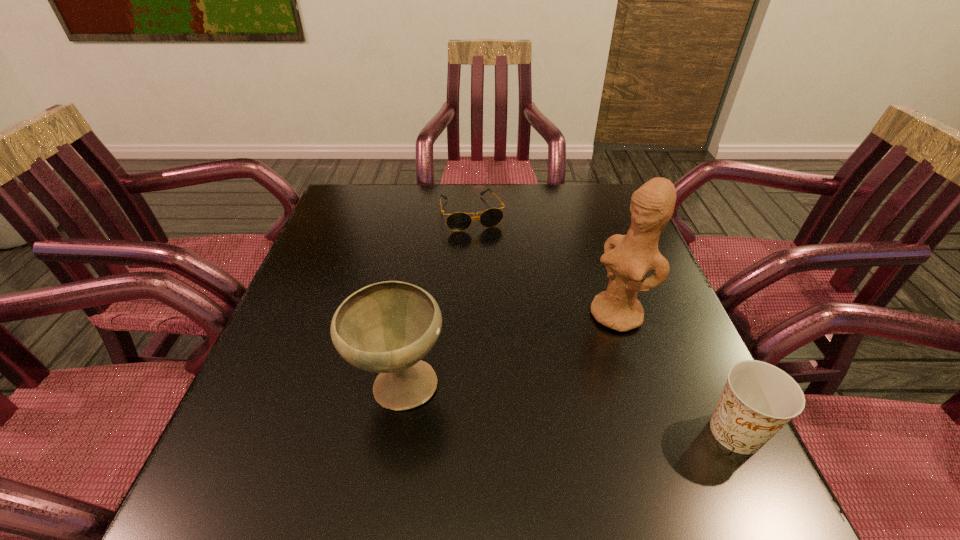
Identify the location of the second tallest object. The image size is (960, 540). (388, 327).

I want to click on Dixie cup, so click(x=759, y=399).

Where is `the second shortest object`? The height and width of the screenshot is (540, 960). the second shortest object is located at coordinates (759, 399).

Find the location of `the second farthest object`. the second farthest object is located at coordinates (628, 258).

Locate an element on the screen. The width and height of the screenshot is (960, 540). the tallest object is located at coordinates (628, 258).

The height and width of the screenshot is (540, 960). In order to click on sunglasses in this screenshot , I will do `click(458, 221)`.

You are a GUI agent. You are given a task and a screenshot of the screen. Output one action in this format:
    pyautogui.click(x=<x>, y=<y>)
    Task: Click on the shortest object
    The height and width of the screenshot is (540, 960).
    Given the screenshot: What is the action you would take?
    pyautogui.click(x=458, y=221)

The width and height of the screenshot is (960, 540). Identify the location of blank space located on the right of the chalice. (530, 386).

Locate an element on the screen. Image resolution: width=960 pixels, height=540 pixels. free location located 0.140m on the back of the Dixie cup is located at coordinates (695, 347).

You are a GUI agent. You are given a task and a screenshot of the screen. Output one action in this format:
    pyautogui.click(x=<x>, y=<y>)
    Task: Click on the blank area located on the front-facing side of the second farthest object
    The image size is (960, 540).
    Given the screenshot: What is the action you would take?
    pos(488,422)